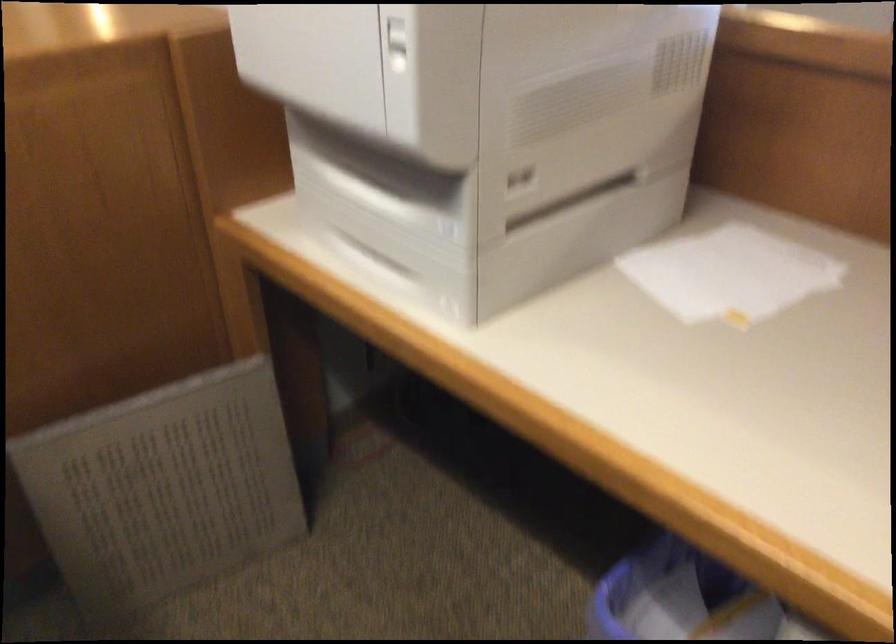
The image size is (896, 644). Describe the element at coordinates (397, 44) in the screenshot. I see `the white power button` at that location.